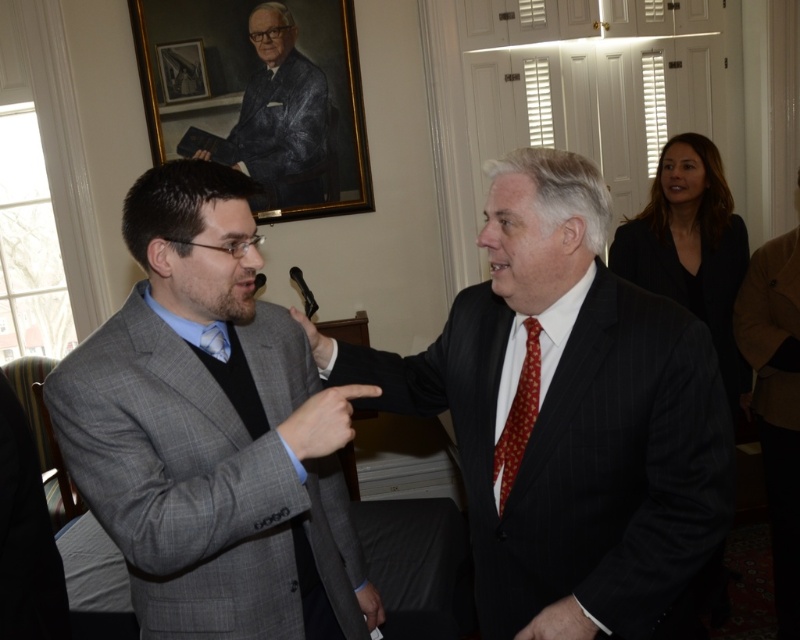
Between brown wool coat at lower right and blue fabric suit at upper center, which one is positioned higher?

blue fabric suit at upper center is higher up.

Measure the distance from brown wool coat at lower right to blue fabric suit at upper center.

brown wool coat at lower right is 7.96 feet from blue fabric suit at upper center.

Which is behind, point (786, 621) or point (248, 161)?

The point (248, 161) is behind.

Locate an element on the screen. This screenshot has width=800, height=640. brown wool coat at lower right is located at coordinates (776, 403).

Which is behind, point (522, 205) or point (10, 424)?

The point (522, 205) is more distant.

Does point (574, 172) come behind point (42, 500)?

That is False.

The width and height of the screenshot is (800, 640). What do you see at coordinates (570, 419) in the screenshot? I see `matte black suit at center` at bounding box center [570, 419].

Locate an element on the screen. The image size is (800, 640). matte black suit at center is located at coordinates (570, 419).

Is point (324, 189) closer to viewer compared to point (532, 330)?

No, it is behind (532, 330).

At what (x,y) coordinates should I click in order to perform the action: click on blue fabric suit at upper center. Please return your answer as a coordinate pair (x, y). The width and height of the screenshot is (800, 640). Looking at the image, I should click on (281, 116).

Locate an element on the screen. The height and width of the screenshot is (640, 800). blue fabric suit at upper center is located at coordinates (281, 116).